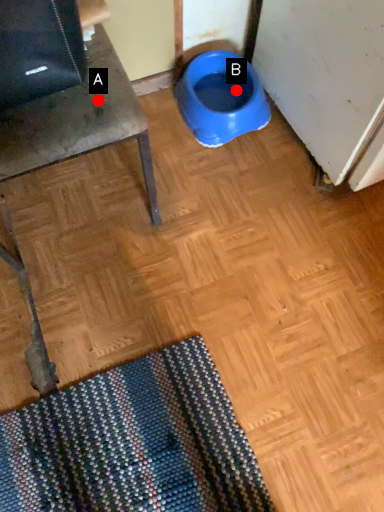
Question: Two points are circled on the image, labeled by A and B beside each circle. Which point is farther from the camera taking this photo?

Choices:
 (A) A is further
 (B) B is further

Answer: (B)